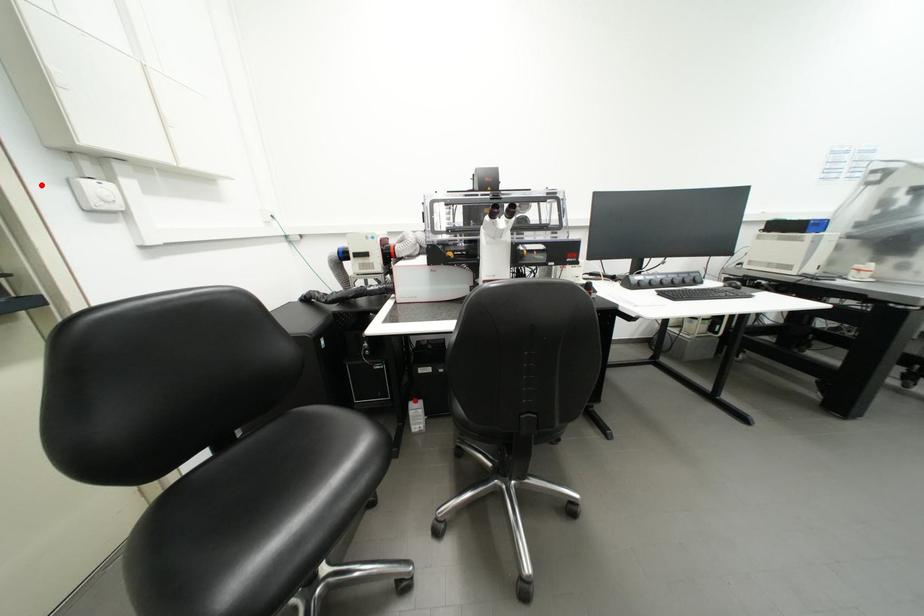
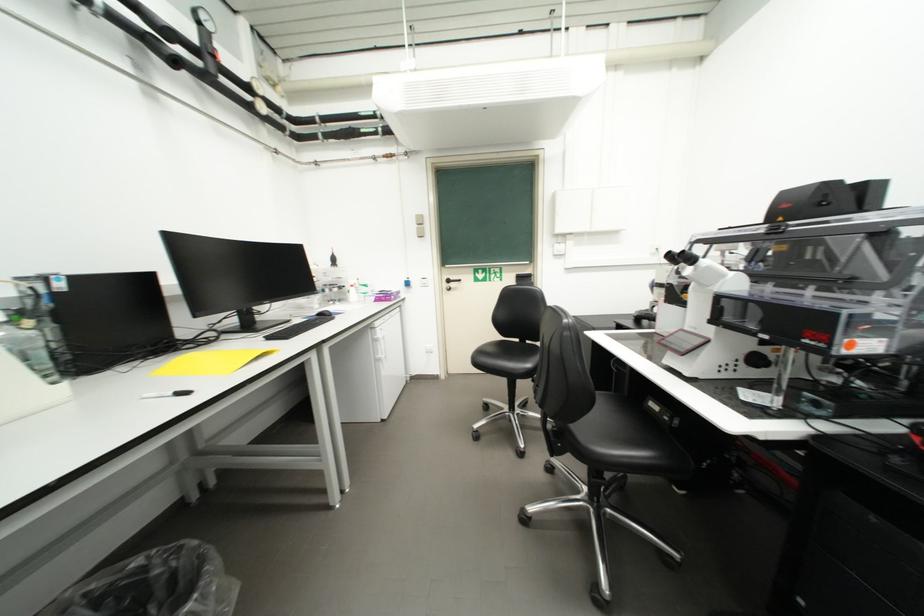
Find the pixel in the second image that matches the highlighted location in the first image.

(553, 249)